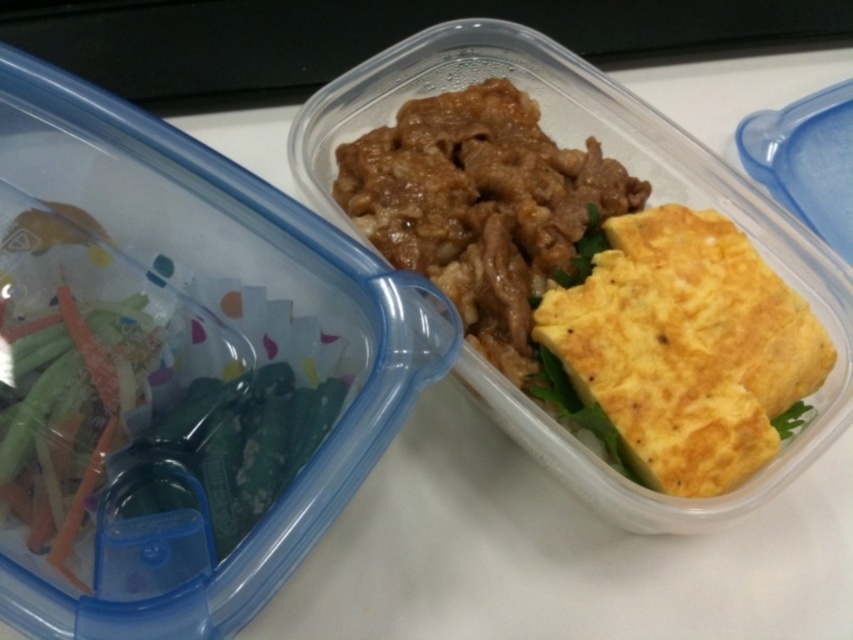
You are a food delivery person who needs to pack these two containers into a box that can only hold items with a combined width of 30 cm. The yellow soft omelet at center right and brown glossy beef at center are both on the table. Which one is narrower so that you can fit both into the box?

The yellow soft omelet at center right is smaller in size compared to the brown glossy beef at center, so it is narrower. Therefore, both can fit into the box as long as their combined widths do not exceed 30 cm.

You are a food delivery person who needs to stack these two containers to deliver them. The container with the yellow soft omelet at center right and the brown glossy beef at center must be placed on top of each other. Which container should go on top to prevent the top container from tipping over?

The yellow soft omelet at center right should be placed on top because it is thinner than the brown glossy beef at center, making it more stable when stacked.

You are a food delivery person who needs to hand over the dishes to the customer. You want to ensure that the yellow soft omelet at center right and the brown glossy beef at center are both visible to the customer. Which container should you hold closer to the customer to make sure both are visible?

Hold the container with the yellow soft omelet at center right closer to the customer since it is already closer to the viewer than the brown glossy beef at center, ensuring both items are visible.